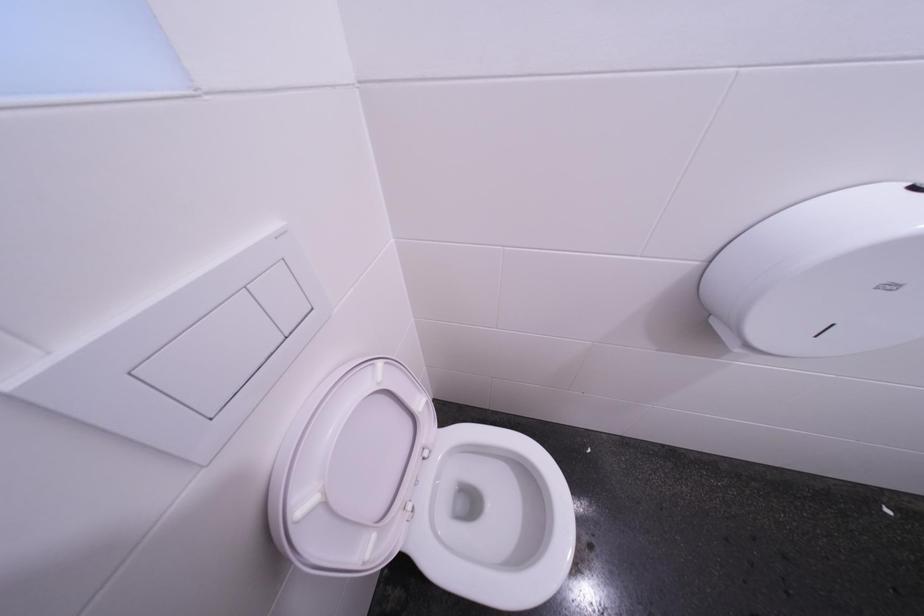
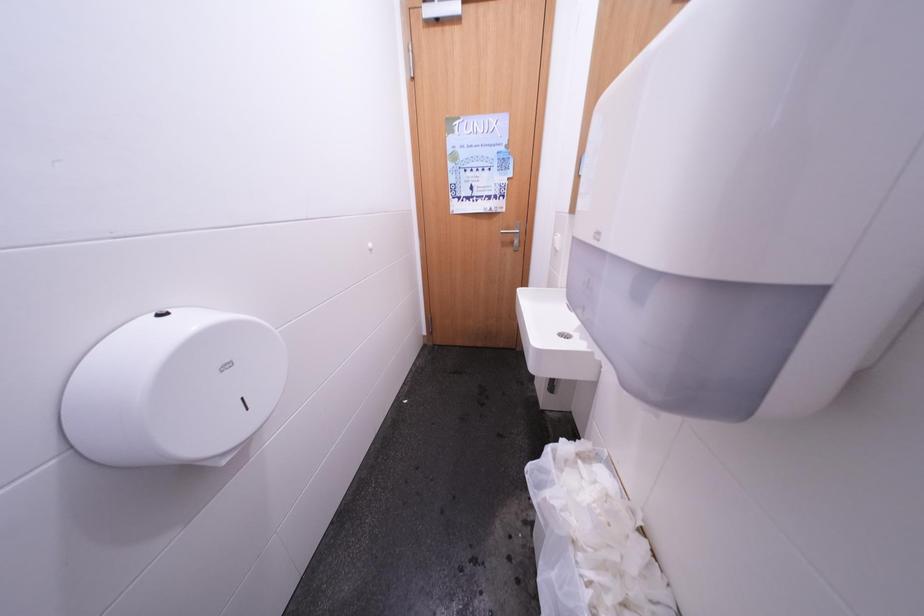
The images are taken continuously from a first-person perspective. In which direction is your viewpoint rotating?

The camera rotated toward right-down.